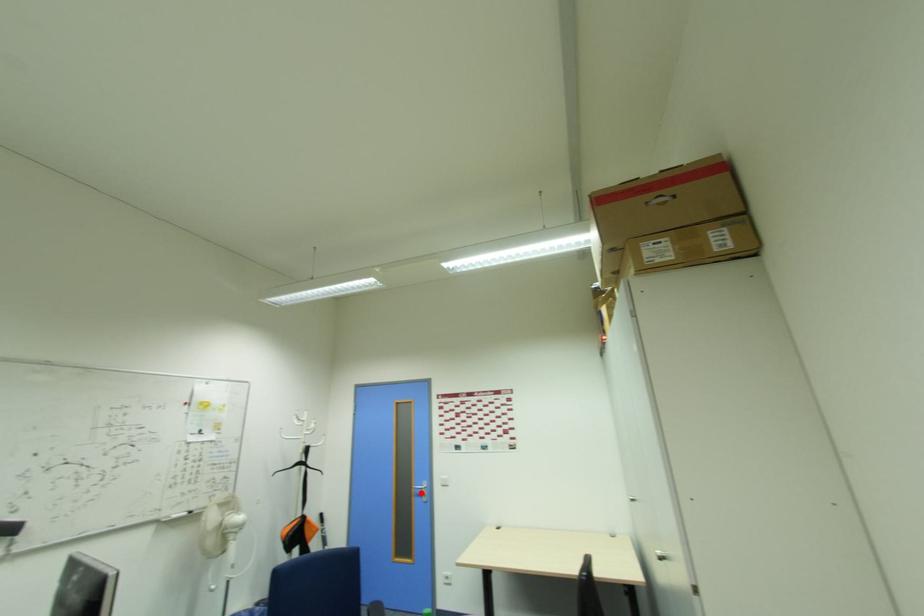
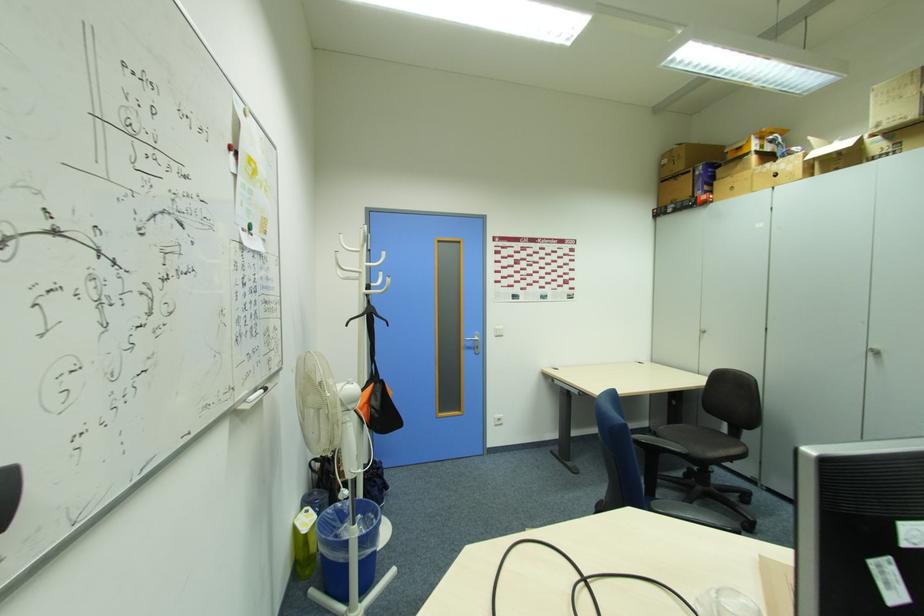
Where in the second image is the point corresponding to the highlighted location from the first image?

(472, 346)